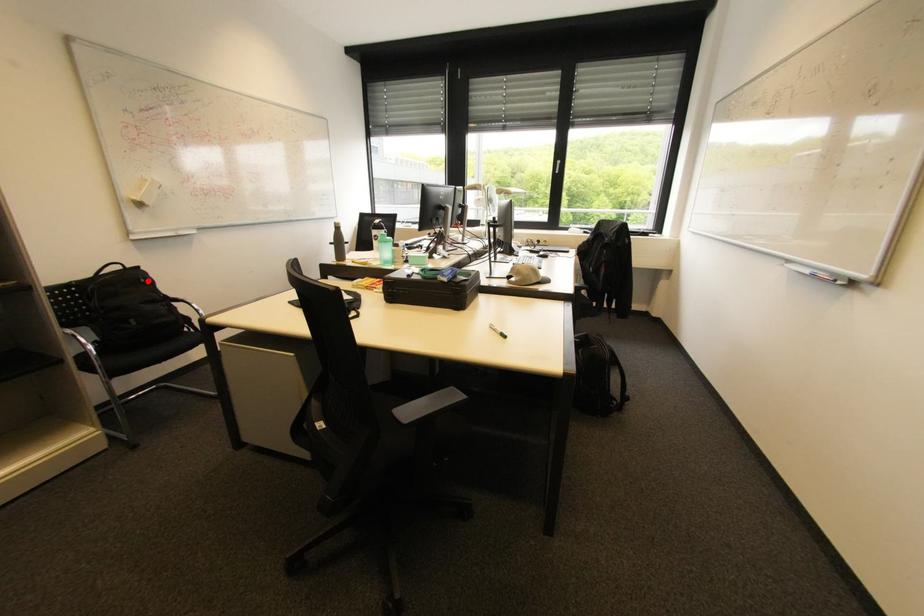
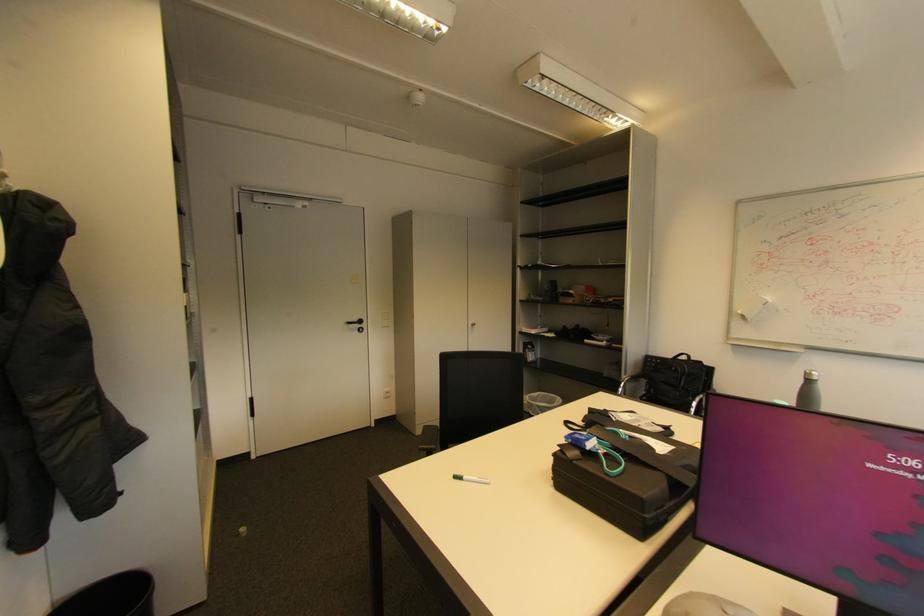
In the second image, find the point that corresponds to the highlighted location in the first image.

(678, 369)